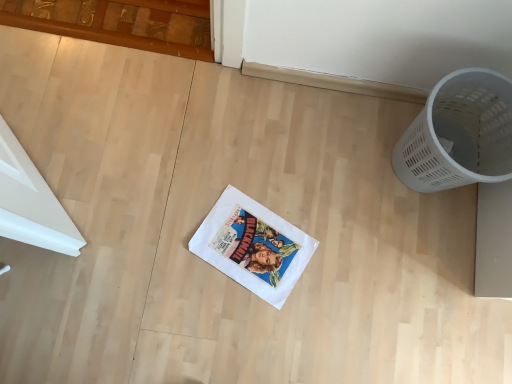
At what (x,y) coordinates should I click in order to perform the action: click on vacant space in front of white plastic basket at right. Please return your answer as a coordinate pair (x, y). This screenshot has width=512, height=384. Looking at the image, I should click on (404, 253).